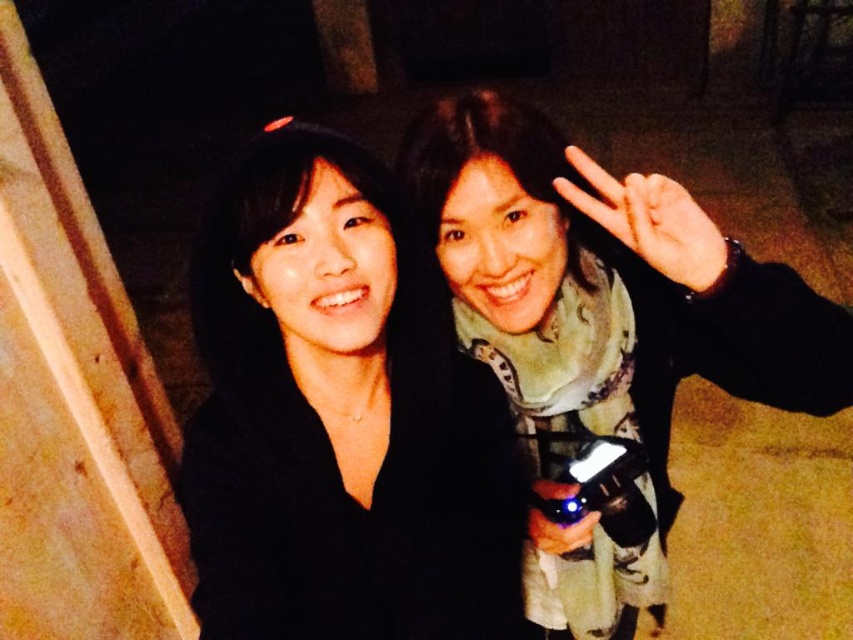
Question: Which object is farther from the camera taking this photo?

Choices:
 (A) matte black camera at right
 (B) matte black hand at upper right

Answer: (B)

Question: Does black matte jacket at center appear under matte black hand at upper right?

Choices:
 (A) yes
 (B) no

Answer: (A)

Question: Is the position of matte black hand at upper right more distant than that of matte black flashlight at lower center?

Choices:
 (A) yes
 (B) no

Answer: (B)

Question: Among these objects, which one is farthest from the camera?

Choices:
 (A) black matte jacket at center
 (B) matte black camera at right
 (C) matte black flashlight at lower center

Answer: (C)

Question: Does matte black camera at right have a smaller size compared to matte black hand at upper right?

Choices:
 (A) yes
 (B) no

Answer: (B)

Question: Which is farther from the matte black flashlight at lower center?

Choices:
 (A) matte black hand at upper right
 (B) black matte jacket at center
 (C) matte black camera at right

Answer: (A)